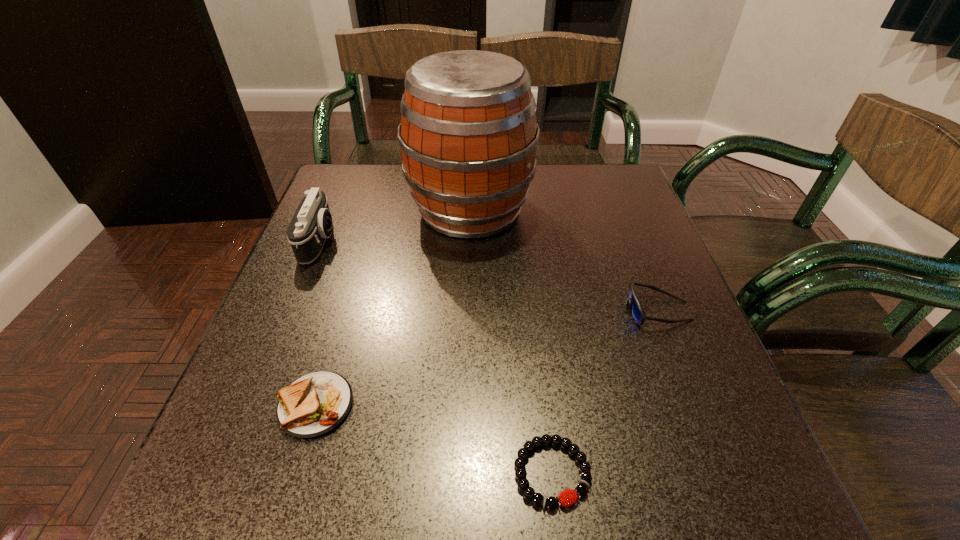
Where is `vacant space that satisfies the following two spatial constraints: 1. on the front lens of the leftmost object; 2. on the right side of the shortest object`? The height and width of the screenshot is (540, 960). vacant space that satisfies the following two spatial constraints: 1. on the front lens of the leftmost object; 2. on the right side of the shortest object is located at coordinates (226, 472).